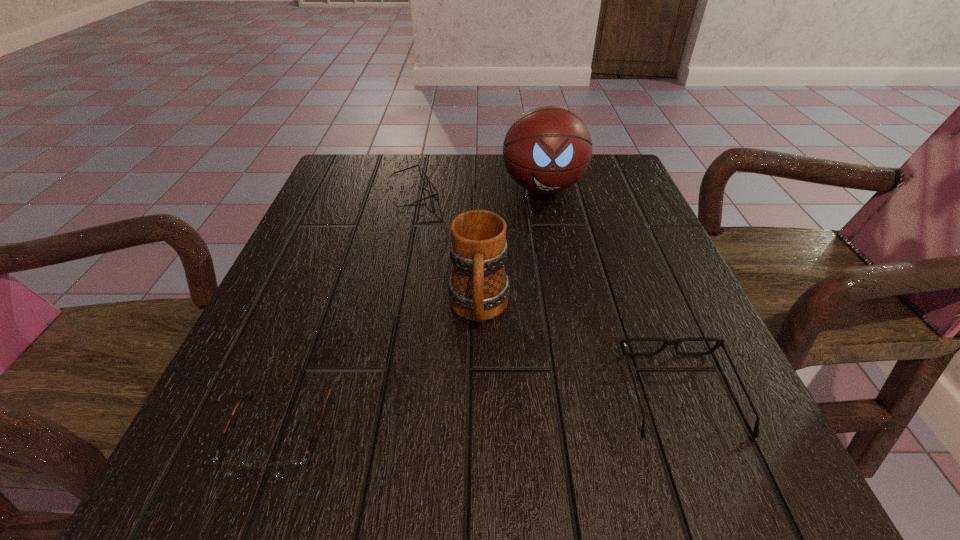
The width and height of the screenshot is (960, 540). I want to click on basketball, so click(x=548, y=149).

Image resolution: width=960 pixels, height=540 pixels. I want to click on mug, so click(478, 286).

Locate an element on the screen. the third nearest object is located at coordinates (478, 286).

Image resolution: width=960 pixels, height=540 pixels. What are the coordinates of `the farthest spectacles` in the screenshot? It's located at pyautogui.click(x=422, y=174).

At what (x,y) coordinates should I click in order to perform the action: click on the rightmost spectacles. Please return your answer as a coordinate pair (x, y). Image resolution: width=960 pixels, height=540 pixels. Looking at the image, I should click on (719, 342).

The image size is (960, 540). I want to click on free point located 0.170m on the left of the basketball, so click(435, 188).

Identify the location of free space located 0.200m on the side of the third nearest object with the handle. The height and width of the screenshot is (540, 960). (478, 459).

The width and height of the screenshot is (960, 540). Identify the location of vacant area located 0.220m with the lenses facing outward on the farthest spectacles. (529, 195).

Locate an element on the screen. This screenshot has height=540, width=960. free space located on the front-facing side of the rightmost spectacles is located at coordinates (632, 267).

Image resolution: width=960 pixels, height=540 pixels. I want to click on free region located 0.260m on the front-facing side of the rightmost spectacles, so click(x=627, y=254).